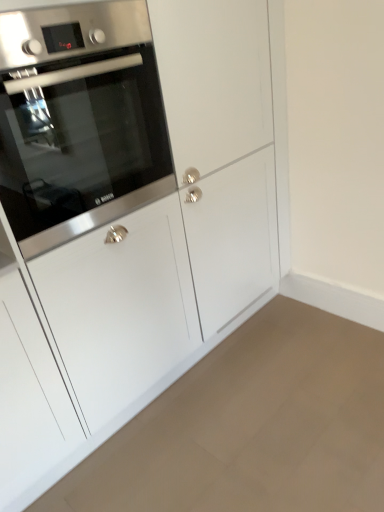
This screenshot has height=512, width=384. Describe the element at coordinates (79, 120) in the screenshot. I see `stainless steel oven at left` at that location.

Where is `stainless steel oven at left`? The image size is (384, 512). stainless steel oven at left is located at coordinates (79, 120).

Measure the distance between matte white cabinet at lower left and camera.

They are 4.34 feet apart.

This screenshot has width=384, height=512. Describe the element at coordinates (252, 426) in the screenshot. I see `matte white cabinet at lower left` at that location.

The height and width of the screenshot is (512, 384). What are the coordinates of `matte white cabinet at lower left` in the screenshot? It's located at (252, 426).

At what (x,y) coordinates should I click in order to perform the action: click on stainless steel oven at left. Please return your answer as a coordinate pair (x, y). Looking at the image, I should click on (79, 120).

Considering the positions of objects matte white cabinet at lower left and stainless steel oven at left in the image provided, who is more to the right, matte white cabinet at lower left or stainless steel oven at left?

From the viewer's perspective, matte white cabinet at lower left appears more on the right side.

Which is behind, matte white cabinet at lower left or stainless steel oven at left?

stainless steel oven at left is further away from the camera.

Is point (360, 455) closer or farther from the camera than point (126, 194)?

Clearly, point (360, 455) is more distant from the camera than point (126, 194).

From the image's perspective, does matte white cabinet at lower left appear lower than stainless steel oven at left?

Yes.

From a real-world perspective, is matte white cabinet at lower left positioned above or below stainless steel oven at left?

matte white cabinet at lower left is situated lower than stainless steel oven at left in the real world.

Does matte white cabinet at lower left have a greater width compared to stainless steel oven at left?

Yes.

In the scene shown: Which of these two, matte white cabinet at lower left or stainless steel oven at left, stands shorter?

matte white cabinet at lower left.

Does matte white cabinet at lower left have a larger size compared to stainless steel oven at left?

Actually, matte white cabinet at lower left might be smaller than stainless steel oven at left.

Can we say matte white cabinet at lower left lies outside stainless steel oven at left?

matte white cabinet at lower left is positioned outside stainless steel oven at left.

Does matte white cabinet at lower left touch stainless steel oven at left?

They are not placed beside each other.

Is matte white cabinet at lower left aimed at stainless steel oven at left?

No, matte white cabinet at lower left is not turned towards stainless steel oven at left.

Where is `oven above the matte white cabinet at lower left (from a real-world perspective)`? oven above the matte white cabinet at lower left (from a real-world perspective) is located at coordinates (79, 120).

Considering the positions of objects stainless steel oven at left and matte white cabinet at lower left in the image provided, who is more to the right, stainless steel oven at left or matte white cabinet at lower left?

matte white cabinet at lower left.

Considering the relative positions of stainless steel oven at left and matte white cabinet at lower left in the image provided, is stainless steel oven at left behind matte white cabinet at lower left?

Yes, stainless steel oven at left is further from the viewer.

Is point (116, 148) positioned in front of point (309, 398)?

Yes, point (116, 148) is in front of point (309, 398).

From the image's perspective, does stainless steel oven at left appear higher than matte white cabinet at lower left?

Yes, from the image's perspective, stainless steel oven at left is over matte white cabinet at lower left.

From a real-world perspective, is stainless steel oven at left above or below matte white cabinet at lower left?

From a real-world perspective, stainless steel oven at left is physically above matte white cabinet at lower left.

Looking at this image, considering the relative sizes of stainless steel oven at left and matte white cabinet at lower left in the image provided, is stainless steel oven at left wider than matte white cabinet at lower left?

Incorrect, the width of stainless steel oven at left does not surpass that of matte white cabinet at lower left.

Looking at this image, is stainless steel oven at left taller or shorter than matte white cabinet at lower left?

Considering their sizes, stainless steel oven at left has more height than matte white cabinet at lower left.

Looking at the image, does stainless steel oven at left seem bigger or smaller compared to matte white cabinet at lower left?

Considering their sizes, stainless steel oven at left takes up more space than matte white cabinet at lower left.

Would you say matte white cabinet at lower left is part of stainless steel oven at left's contents?

Result: No, matte white cabinet at lower left is located outside of stainless steel oven at left.

Are stainless steel oven at left and matte white cabinet at lower left far apart?

Indeed, stainless steel oven at left is not near matte white cabinet at lower left.

Is stainless steel oven at left looking in the opposite direction of matte white cabinet at lower left?

stainless steel oven at left does not have its back to matte white cabinet at lower left.

How much distance is there between stainless steel oven at left and matte white cabinet at lower left?

A distance of 3.63 feet exists between stainless steel oven at left and matte white cabinet at lower left.

Find the location of a particular element. Image resolution: width=384 pixels, height=512 pixels. oven behind the matte white cabinet at lower left is located at coordinates (79, 120).

The width and height of the screenshot is (384, 512). What are the coordinates of `oven behind the matte white cabinet at lower left` in the screenshot? It's located at (79, 120).

Identify the location of plain on the right side of stainless steel oven at left. Image resolution: width=384 pixels, height=512 pixels. (252, 426).